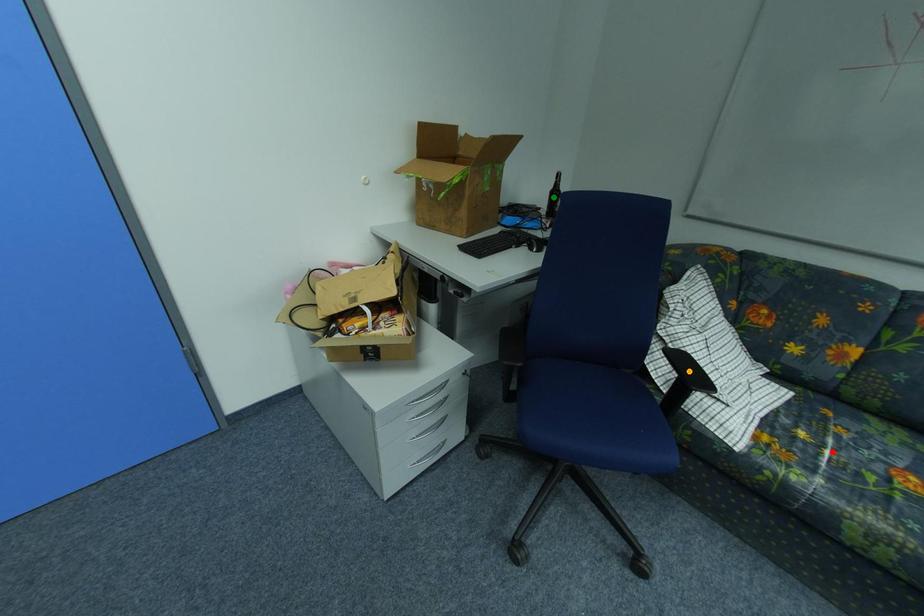
Order these from farthest to nearest:
orange point
green point
red point

green point < orange point < red point